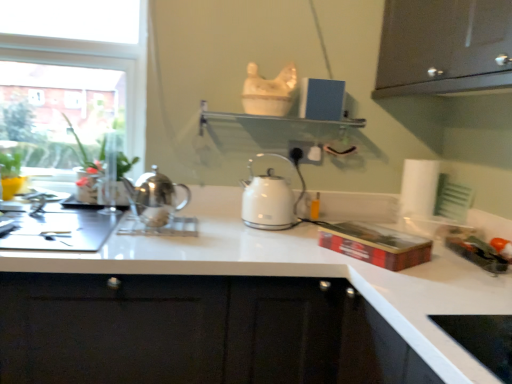
The height and width of the screenshot is (384, 512). What do you see at coordinates (271, 197) in the screenshot? I see `white glossy kettle at center, which is the second kettle from left to right` at bounding box center [271, 197].

Describe the element at coordinates (154, 198) in the screenshot. I see `polished silver kettle at center, which ranks as the 1th kettle in left-to-right order` at that location.

This screenshot has height=384, width=512. What are the coordinates of `polished silver kettle at center, the 2th kettle positioned from the right` in the screenshot? It's located at (154, 198).

What do you see at coordinates (96, 68) in the screenshot?
I see `transparent glass window at upper left` at bounding box center [96, 68].

Measure the distance between point (54, 48) and camera.

Point (54, 48) and camera are 5.80 feet apart.

The image size is (512, 384). Describe the element at coordinates (86, 152) in the screenshot. I see `green glossy plant at left` at that location.

In order to click on glossy dark wood cabinet at upper right in this screenshot , I will do `click(444, 46)`.

Find the location of a particular element. white glossy countertop at center is located at coordinates (311, 273).

Is polished silver kettle at center, the 2th kettle positioned from the right, wider or thinner than white paper towel at right?

Clearly, polished silver kettle at center, the 2th kettle positioned from the right, has less width compared to white paper towel at right.

Is point (161, 216) more distant than point (421, 197)?

No, it is not.

Is polished silver kettle at center, the 1th kettle viewed from the front, inside or outside of white paper towel at right?

polished silver kettle at center, the 1th kettle viewed from the front, is outside white paper towel at right.

Which is more distant, (202, 243) or (498, 30)?

The point (202, 243) is behind.

Does white glossy countertop at center appear on the left side of glossy dark wood cabinet at upper right?

Correct, you'll find white glossy countertop at center to the left of glossy dark wood cabinet at upper right.

Considering the relative sizes of white glossy countertop at center and glossy dark wood cabinet at upper right in the image provided, is white glossy countertop at center bigger than glossy dark wood cabinet at upper right?

Yes.

Is glossy dark wood cabinet at upper right located within white glossy shelf at upper center?

No.

Is glossy dark wood cabinet at upper right at the back of white glossy shelf at upper center?

No, glossy dark wood cabinet at upper right is not at the back of white glossy shelf at upper center.

Is the depth of white glossy shelf at upper center greater than that of glossy dark wood cabinet at upper right?

Yes.

Locate an element on the screen. The width and height of the screenshot is (512, 384). electric outlet behind the white paper towel at right is located at coordinates (306, 151).

How distant is white paper towel at right from white plastic electric outlet at center?

white paper towel at right and white plastic electric outlet at center are 16.11 inches apart.

Is white paper towel at right oriented towards white plastic electric outlet at center?

No, white paper towel at right is not turned towards white plastic electric outlet at center.

Could you tell me if white plastic electric outlet at center is turned towards white glossy countertop at center?

No, white plastic electric outlet at center is not oriented towards white glossy countertop at center.

Is white glossy countertop at center a part of white plastic electric outlet at center?

No, white glossy countertop at center is located outside of white plastic electric outlet at center.

Considering the relative sizes of white plastic electric outlet at center and white glossy countertop at center in the image provided, is white plastic electric outlet at center smaller than white glossy countertop at center?

Yes.

Between transparent glass window at upper left and white paper towel at right, which one has larger size?

Bigger between the two is transparent glass window at upper left.

From the image's perspective, is transparent glass window at upper left under white paper towel at right?

No.

Is transparent glass window at upper left located outside white paper towel at right?

Yes, transparent glass window at upper left is not within white paper towel at right.

Can you confirm if white glossy countertop at center is taller than transparent glass window at upper left?

No, white glossy countertop at center is not taller than transparent glass window at upper left.

Which object is positioned more to the left, white glossy countertop at center or transparent glass window at upper left?

Positioned to the left is transparent glass window at upper left.

Locate an element on the screen. This screenshot has width=512, height=384. countertop located in front of the transparent glass window at upper left is located at coordinates (311, 273).

Is white glossy countertop at center positioned far away from transparent glass window at upper left?

white glossy countertop at center is near transparent glass window at upper left, not far away.

Locate an element on the screen. The image size is (512, 384). paper towel above the polished silver kettle at center, placed as the 2th kettle when sorted from back to front (from a real-world perspective) is located at coordinates (419, 187).

I want to click on countertop below the glossy dark wood cabinet at upper right (from a real-world perspective), so click(311, 273).

Based on their spatial positions, is glossy dark wood cabinet at upper right or white glossy shelf at upper center further from white glossy kettle at center, placed as the first kettle when sorted from right to left?

glossy dark wood cabinet at upper right is positioned further to the anchor white glossy kettle at center, placed as the first kettle when sorted from right to left.

When comparing their distances from white plastic electric outlet at center, does white glossy kettle at center, which is the second kettle from left to right, or transparent glass window at upper left seem closer?

white glossy kettle at center, which is the second kettle from left to right, lies closer to white plastic electric outlet at center than the other object.

Which object lies further to the anchor point white glossy kettle at center, placed as the 1th kettle when sorted from back to front, polished silver kettle at center, the 2th kettle positioned from the right, or white glossy countertop at center?

Based on the image, polished silver kettle at center, the 2th kettle positioned from the right, appears to be further to white glossy kettle at center, placed as the 1th kettle when sorted from back to front.

Considering their positions, is white glossy kettle at center, which is the second kettle from left to right, positioned further to white glossy countertop at center than green glossy plant at left?

green glossy plant at left lies further to white glossy countertop at center than the other object.

In the scene shown: Considering their positions, is white glossy kettle at center, which is the second kettle from left to right, positioned closer to polished silver kettle at center, the 1th kettle viewed from the front, than white plastic electric outlet at center?

white glossy kettle at center, which is the second kettle from left to right, is closer to polished silver kettle at center, the 1th kettle viewed from the front.

When comparing their distances from white paper towel at right, does transparent glass window at upper left or white glossy kettle at center, placed as the first kettle when sorted from right to left, seem further?

transparent glass window at upper left is further to white paper towel at right.

When comparing their distances from white glossy shelf at upper center, does white plastic electric outlet at center or polished silver kettle at center, which ranks as the 1th kettle in left-to-right order, seem further?

The object further to white glossy shelf at upper center is polished silver kettle at center, which ranks as the 1th kettle in left-to-right order.

Estimate the real-world distances between objects in this image. Which object is closer to green glossy plant at left, polished silver kettle at center, placed as the 2th kettle when sorted from back to front, or glossy dark wood cabinet at upper right?

polished silver kettle at center, placed as the 2th kettle when sorted from back to front.

Locate an element on the screen. electric outlet situated between green glossy plant at left and glossy dark wood cabinet at upper right from left to right is located at coordinates click(306, 151).

This screenshot has width=512, height=384. Find the location of `shelf between polished silver kettle at center, the 1th kettle viewed from the front, and glossy dark wood cabinet at upper right`. shelf between polished silver kettle at center, the 1th kettle viewed from the front, and glossy dark wood cabinet at upper right is located at coordinates (x=270, y=131).

The height and width of the screenshot is (384, 512). Find the location of `electric outlet between white glossy shelf at upper center and white glossy countertop at center in the vertical direction`. electric outlet between white glossy shelf at upper center and white glossy countertop at center in the vertical direction is located at coordinates (306, 151).

You are a GUI agent. You are given a task and a screenshot of the screen. Output one action in this format:
    pyautogui.click(x=<x>, y=<y>)
    Task: Click on the countertop between transparent glass window at upper left and glossy dark wood cabinet at upper right
    This screenshot has width=512, height=384.
    Given the screenshot: What is the action you would take?
    pyautogui.click(x=311, y=273)